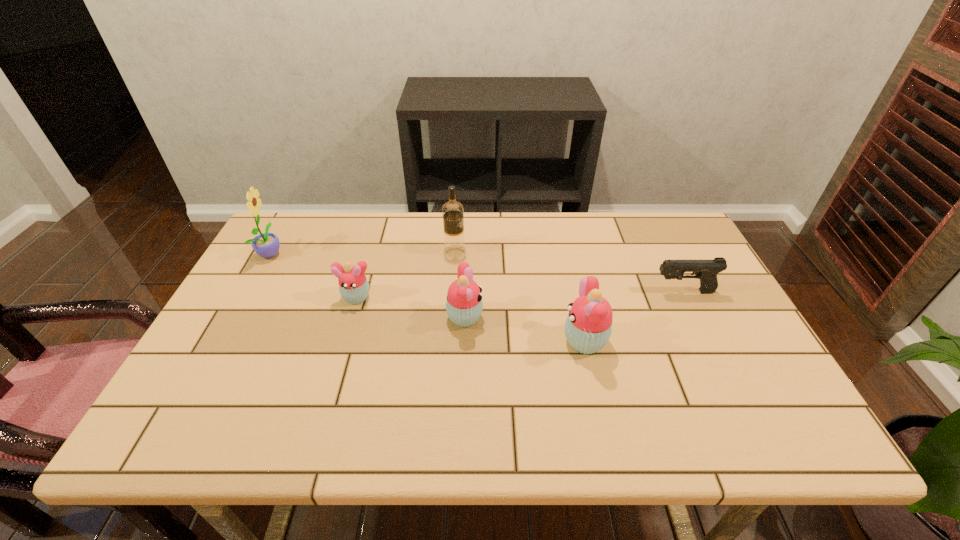
The width and height of the screenshot is (960, 540). Identify the location of vacant space located on the face of the second object from right to left. (453, 341).

The image size is (960, 540). Find the location of `vacant space positioned 0.370m on the face of the second object from right to left`. vacant space positioned 0.370m on the face of the second object from right to left is located at coordinates (413, 341).

Image resolution: width=960 pixels, height=540 pixels. I want to click on free location located on the face of the second object from right to left, so click(x=404, y=341).

The height and width of the screenshot is (540, 960). In order to click on free space located on the label of the vodka in this screenshot , I will do `click(515, 251)`.

You are a GUI agent. You are given a task and a screenshot of the screen. Output one action in this format:
    pyautogui.click(x=<x>, y=<y>)
    Task: Click on the vacant space situated 0.240m on the front-facing side of the sunflower
    This screenshot has width=960, height=540.
    Given the screenshot: What is the action you would take?
    pyautogui.click(x=362, y=253)

Identify the location of vacant space located at the barrel of the pistol. The image size is (960, 540). (577, 292).

I want to click on free region located 0.120m at the barrel of the pistol, so click(x=610, y=292).

The width and height of the screenshot is (960, 540). Identify the location of vacant position located at the barrel of the pistol. (527, 292).

Identify the location of vodka that is at the far edge. The height and width of the screenshot is (540, 960). (454, 245).

In order to click on sunflower situated at the far edge in this screenshot , I will do `click(266, 245)`.